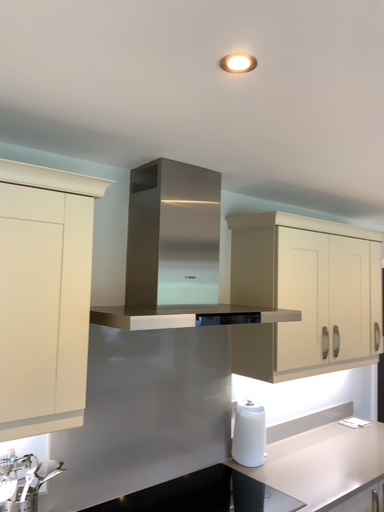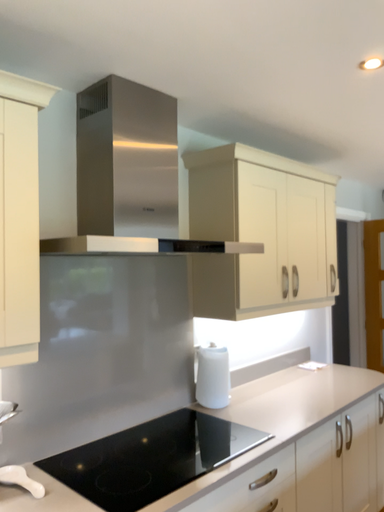
Question: How did the camera likely rotate when shooting the video?

Choices:
 (A) rotated left
 (B) rotated right

Answer: (B)